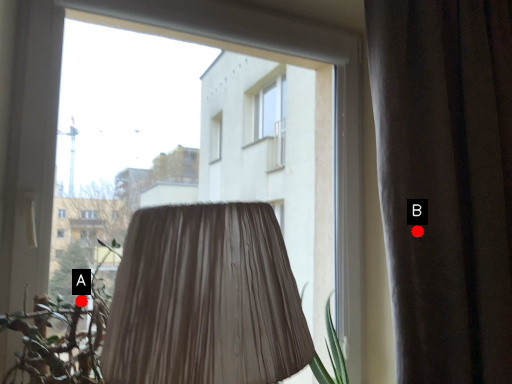
Question: Two points are circled on the image, labeled by A and B beside each circle. Which point is closer to the camera?

Choices:
 (A) A is closer
 (B) B is closer

Answer: (A)